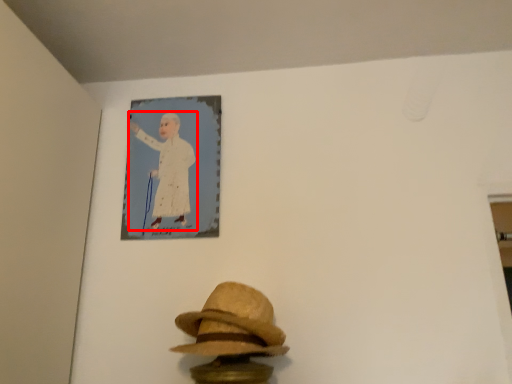
Question: From the image's perspective, what is the correct spatial relationship of person (annotated by the red box) in relation to fedora?

Choices:
 (A) below
 (B) above

Answer: (B)